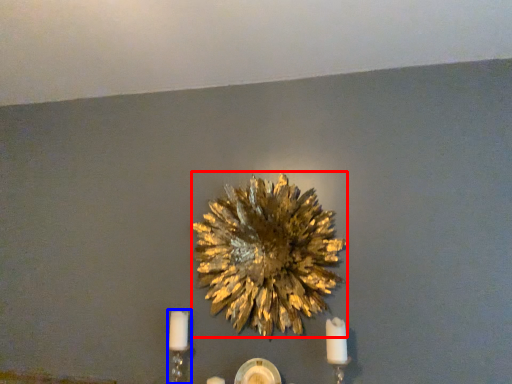
Question: Which object appears closest to the camera in this image, flower (highlighted by a red box) or candle holder (highlighted by a blue box)?

Choices:
 (A) flower
 (B) candle holder

Answer: (A)